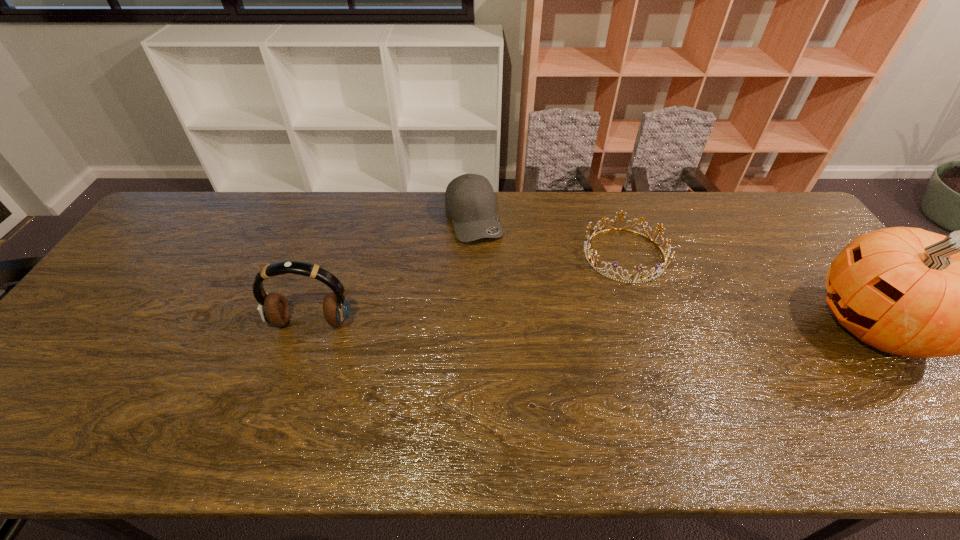
Find the location of `free spot between the shortest object and the second shortest object`. free spot between the shortest object and the second shortest object is located at coordinates (549, 237).

The height and width of the screenshot is (540, 960). I want to click on free space between the second object from left to right and the second tallest object, so click(x=393, y=271).

The height and width of the screenshot is (540, 960). I want to click on free space between the third tallest object and the third shortest object, so click(x=393, y=271).

I want to click on blank region between the leftmost object and the third object from right to left, so click(393, 271).

Identify the location of free space between the headset and the third object from left to right. The width and height of the screenshot is (960, 540). (468, 289).

Identify the location of free space between the second object from right to left and the headset. (468, 289).

Locate an element on the screen. This screenshot has height=540, width=960. object that can be found as the second closest to the tiara is located at coordinates (907, 291).

Image resolution: width=960 pixels, height=540 pixels. What are the coordinates of `the closest object relative to the tallest object` in the screenshot? It's located at (642, 279).